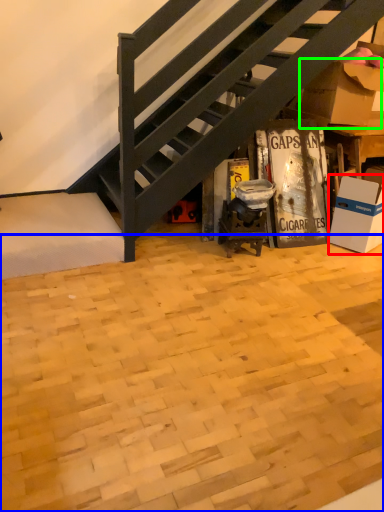
Question: Which object is the closest to the box (highlighted by a red box)? Choose among these: plywood (highlighted by a blue box) or cardboard box (highlighted by a green box).

Choices:
 (A) plywood
 (B) cardboard box

Answer: (B)